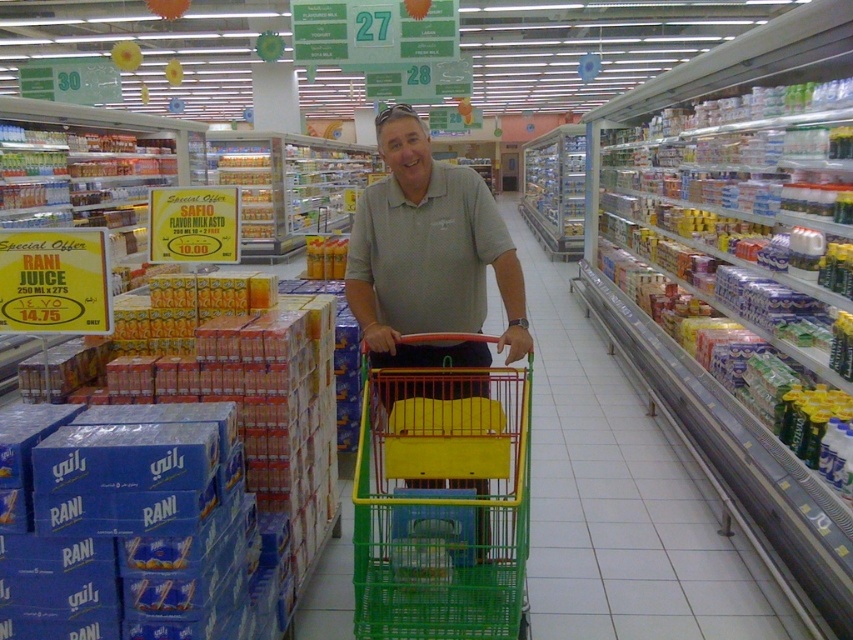
Question: Is green plastic trolley at center closer to the viewer compared to matte gray shirt at center?

Choices:
 (A) yes
 (B) no

Answer: (A)

Question: Which point is closer to the camera?

Choices:
 (A) (465, 451)
 (B) (439, 483)

Answer: (A)

Question: Which point is closer to the camera?

Choices:
 (A) (486, 612)
 (B) (419, 268)

Answer: (A)

Question: Does green plastic trolley at center have a greater width compared to matte gray shirt at center?

Choices:
 (A) no
 (B) yes

Answer: (A)

Question: Is the position of green plastic trolley at center more distant than that of matte gray shirt at center?

Choices:
 (A) yes
 (B) no

Answer: (B)